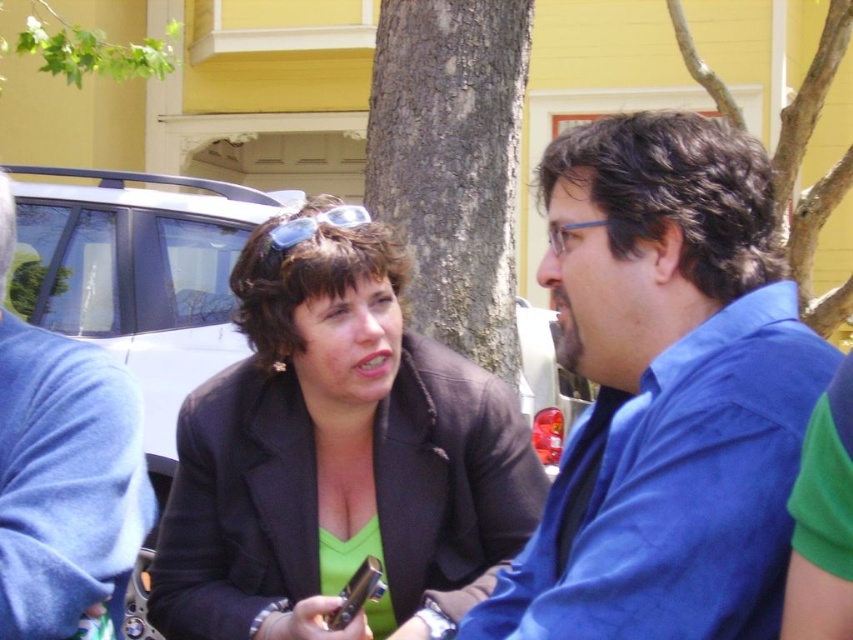
Question: Does brown rough bark tree at center appear on the left side of blue plastic goggles at center?

Choices:
 (A) yes
 (B) no

Answer: (B)

Question: Is brown rough bark tree at center further to the viewer compared to green leafy branch at upper left?

Choices:
 (A) yes
 (B) no

Answer: (B)

Question: Which point is farther from the camera taking this photo?

Choices:
 (A) (279, 225)
 (B) (431, 378)
 (C) (482, 83)

Answer: (C)

Question: Considering the real-world distances, which object is closest to the green leafy branch at upper left?

Choices:
 (A) blue fleece jacket at left
 (B) brown rough bark tree at center
 (C) matte black blazer at center

Answer: (B)

Question: Is matte black blazer at center positioned before green leafy branch at upper left?

Choices:
 (A) yes
 (B) no

Answer: (A)

Question: Which of the following is the farthest from the observer?

Choices:
 (A) brown textured tree trunk at center
 (B) green leafy branch at upper left
 (C) brown rough bark tree at center
 (D) blue plastic goggles at center

Answer: (B)